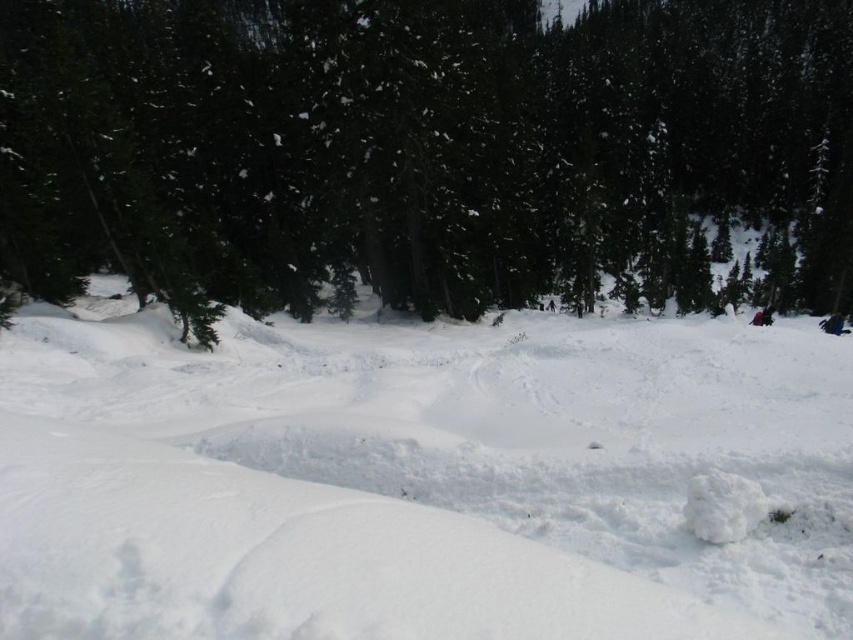
You are navigating a small drone through the snowy forest depicted in the image. You need to fly from the point at coordinates point (355,413) to the point at coordinates point (646,36). According to the scene description, which point is closer to your current position when you start at the first point?

Point (355,413) is in front of point (646,36), so when starting at point (355,413), the point (646,36) is further away from your current position.

You are a hiker trying to navigate through the snowy forest. You see the white fluffy snow at center and the green matte tree at upper center. Which one is closer to you?

The white fluffy snow at center is closer to you because it is in front of the green matte tree at upper center.